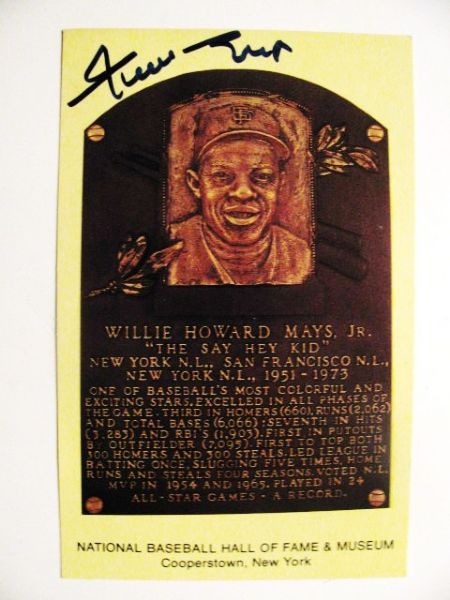
Identify the location of plaque. The image size is (450, 600). (110, 377).